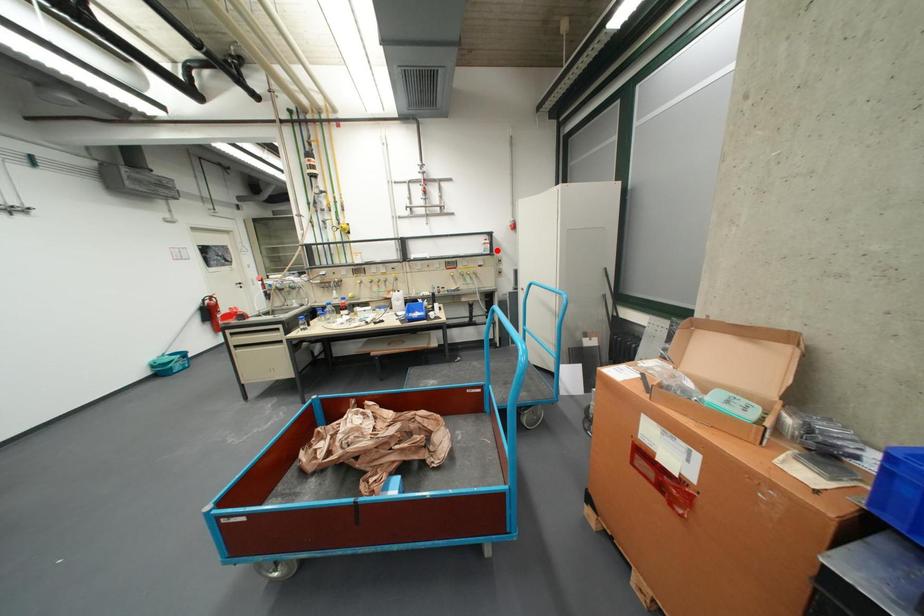
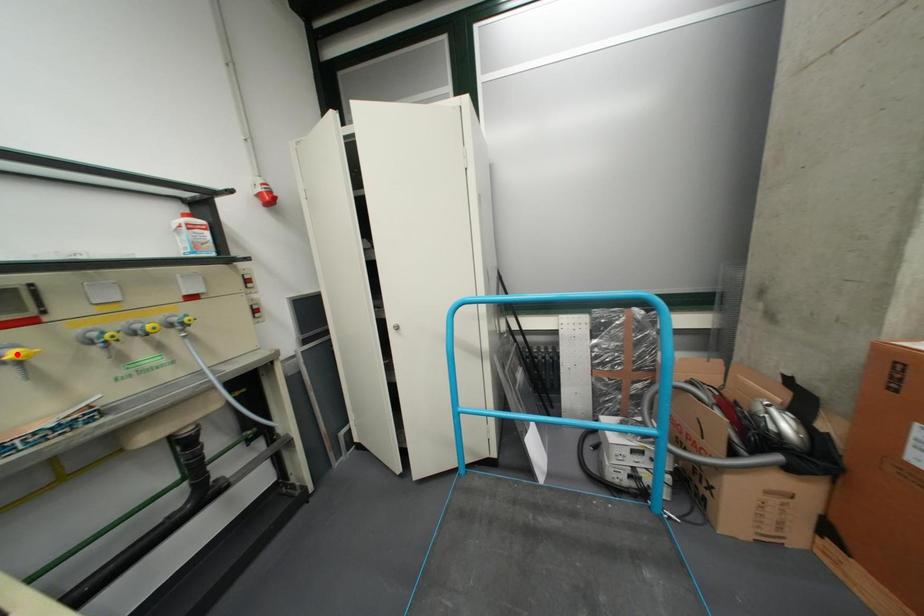
I am providing you with two images of the same scene from different viewpoints. A red point is marked on the first image and another point is marked on the second image. Is the marked point in image1 the same physical position as the marked point in image2?

No